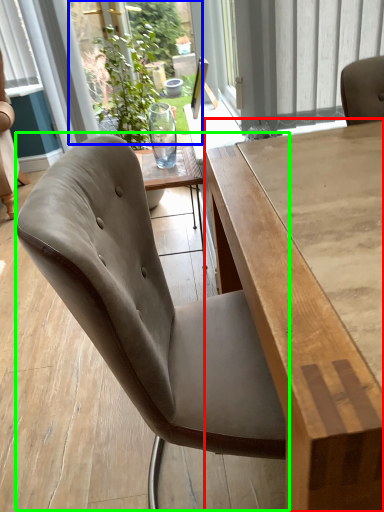
Question: Which object is the farthest from table (highlighted by a red box)? Choose among these: window screen (highlighted by a blue box) or chair (highlighted by a green box).

Choices:
 (A) window screen
 (B) chair

Answer: (A)